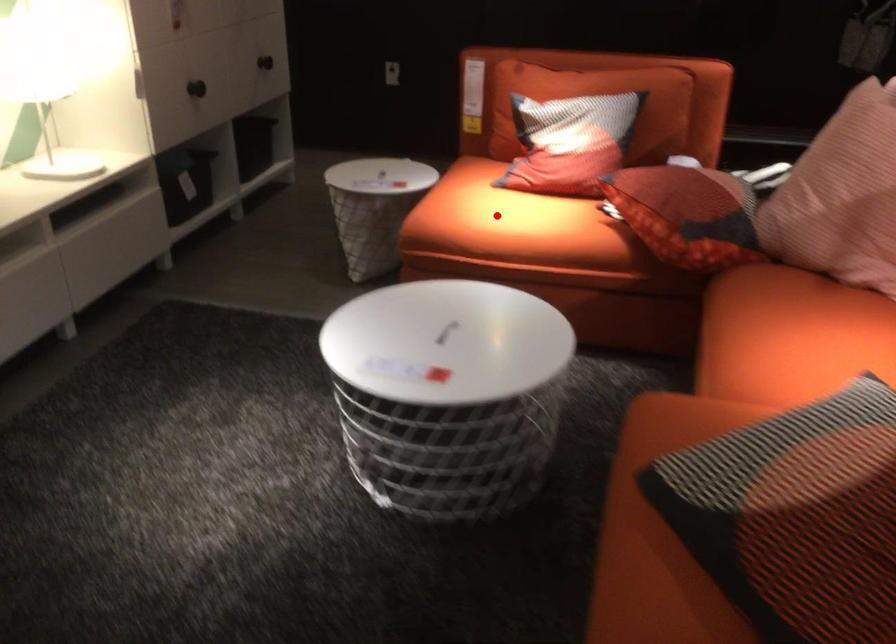
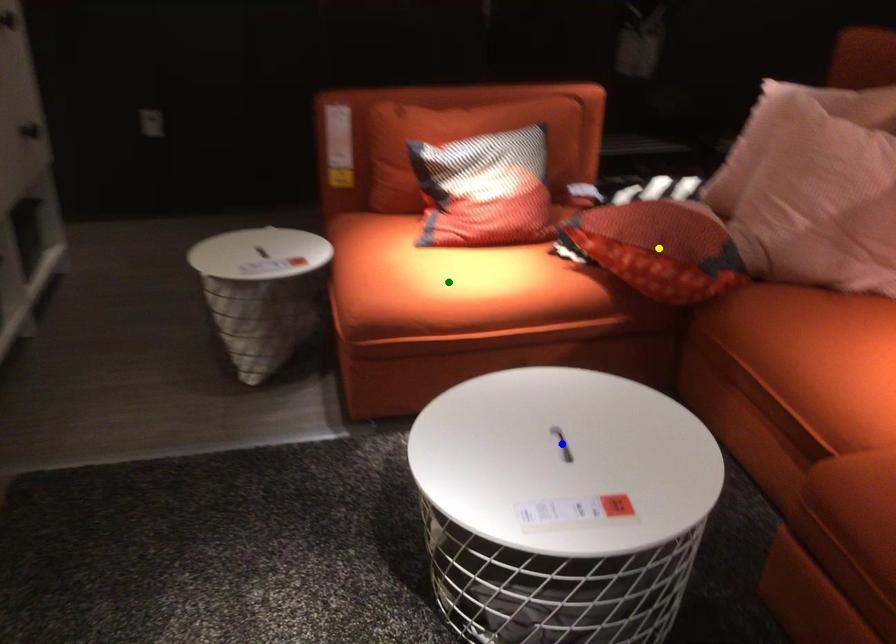
Question: I am providing you with two images of the same scene from different viewpoints. A red point is marked on the first image. You are given multiple points on the second image. Which mark in image 2 goes with the point in image 1?

Choices:
 (A) yellow point
 (B) blue point
 (C) green point

Answer: (C)